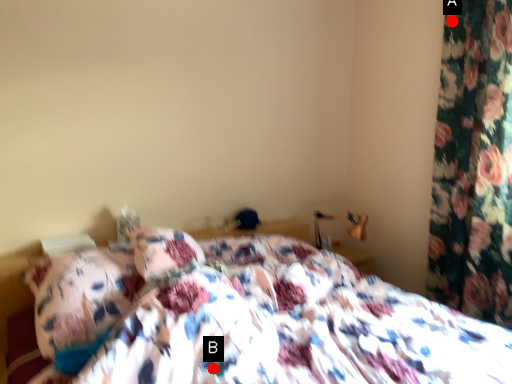
Question: Two points are circled on the image, labeled by A and B beside each circle. Which point is closer to the camera?

Choices:
 (A) A is closer
 (B) B is closer

Answer: (B)